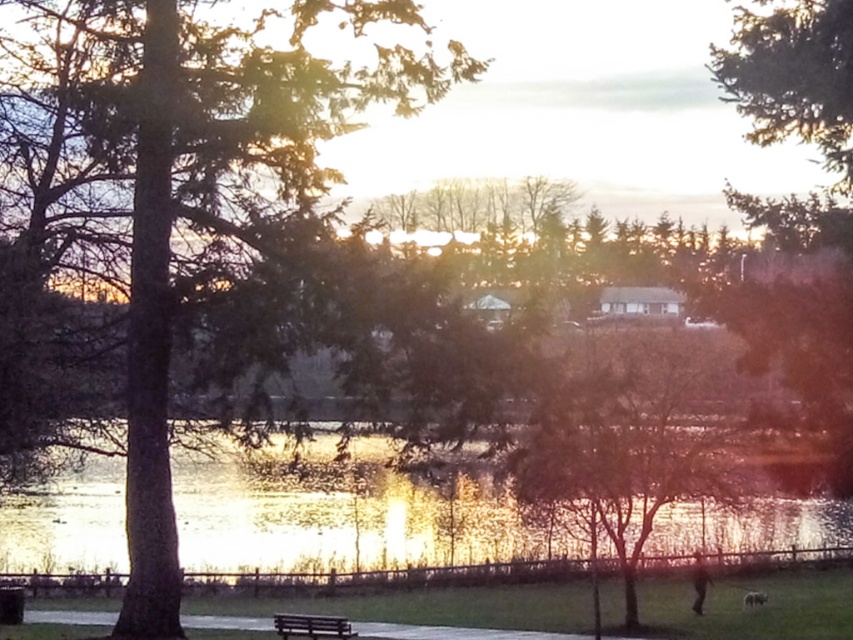
You are standing in the serene outdoor scene depicted. You want to take a photo of the bare branches at center without any obstructions. Based on the distance provided, is it possible to capture the entire tree in your camera frame without moving closer? Please explain your reasoning.

The bare branches at center are 21.84 meters away from the viewer. Since the distance is quite far, it may be challenging to capture the entire tree in the camera frame without moving closer, as most standard camera lenses have a limited field of view at such distances.

In the scene shown: You are an artist setting up your easel to paint the scene. You want to ensure the green textured tree at left and the glistening reflective water at center are both visible in your painting. Considering their sizes in the image, which object should you place higher on the canvas?

The green textured tree at left should be placed higher on the canvas because it has a greater height compared to the glistening reflective water at center.